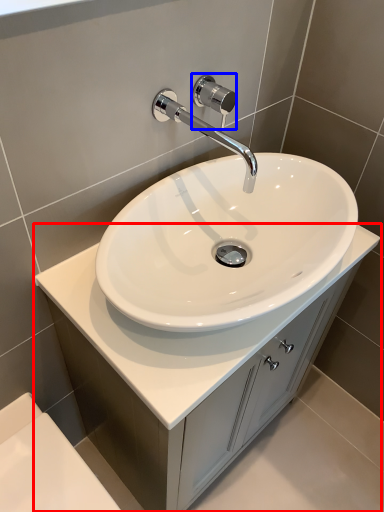
Question: Which object is further to the camera taking this photo, bathroom cabinet (highlighted by a red box) or shower (highlighted by a blue box)?

Choices:
 (A) bathroom cabinet
 (B) shower

Answer: (B)